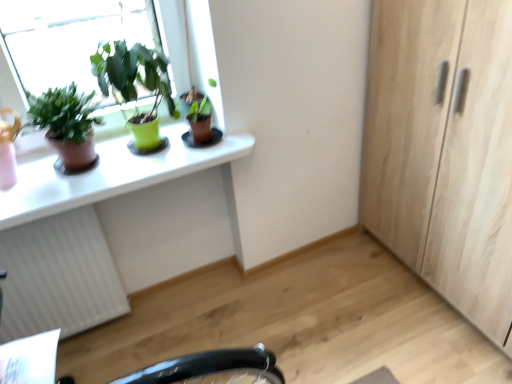
The width and height of the screenshot is (512, 384). Identify the location of free space below matte brown pot at upper left, placed as the first houseplant when sorted from left to right (from a real-world perspective). (x=88, y=172).